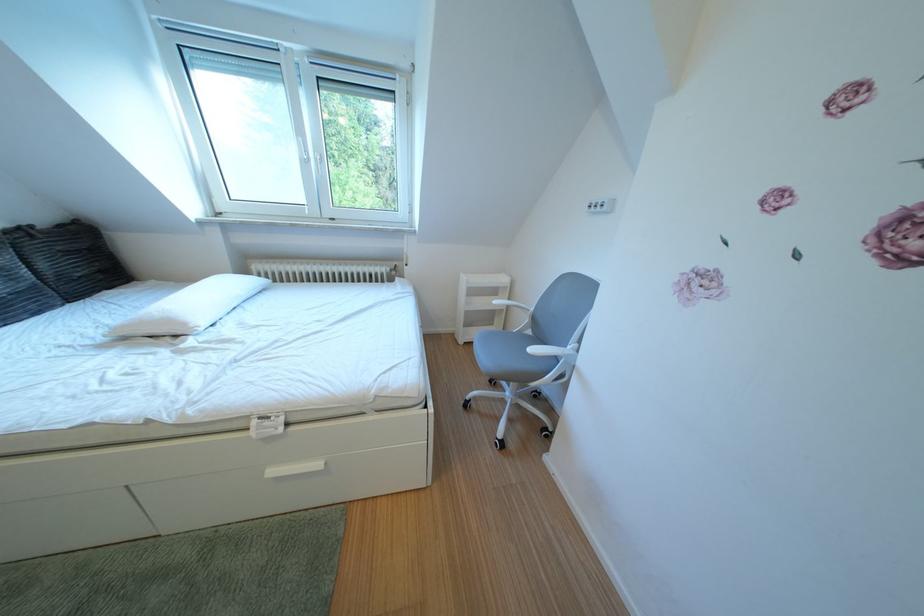
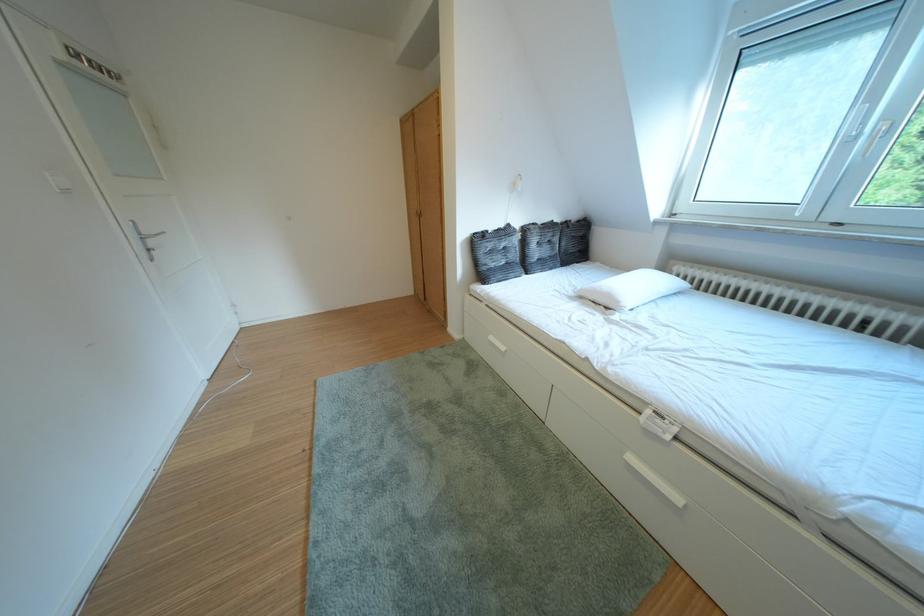
Question: The camera is either moving clockwise (left) or counter-clockwise (right) around the object. The first image is from the beginning of the video and the second image is from the end. Is the camera moving left or right when shooting the video?

Choices:
 (A) Left
 (B) Right

Answer: (B)